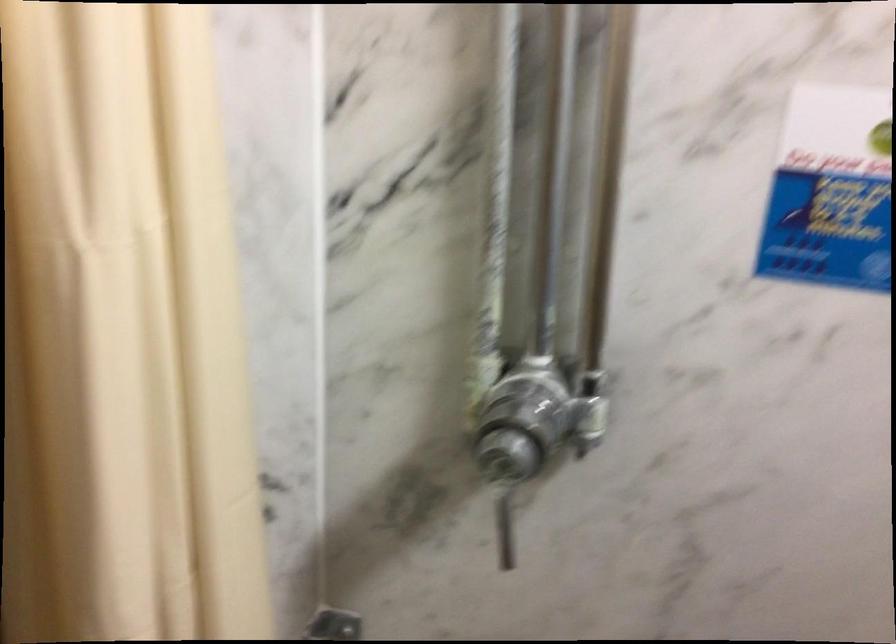
Find where to turn the metal valve knob. Please return your answer as a coordinate pair (x, y).

(533, 421)